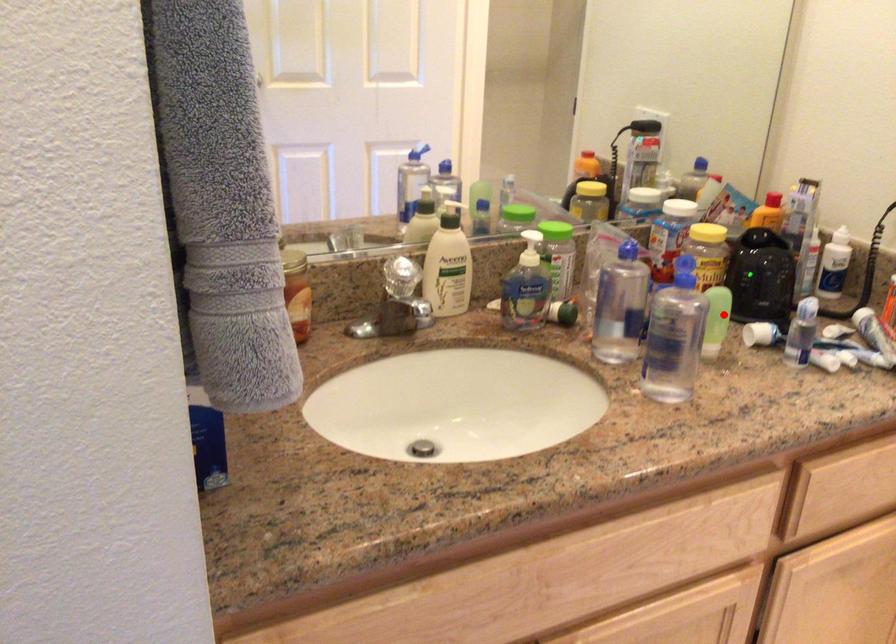
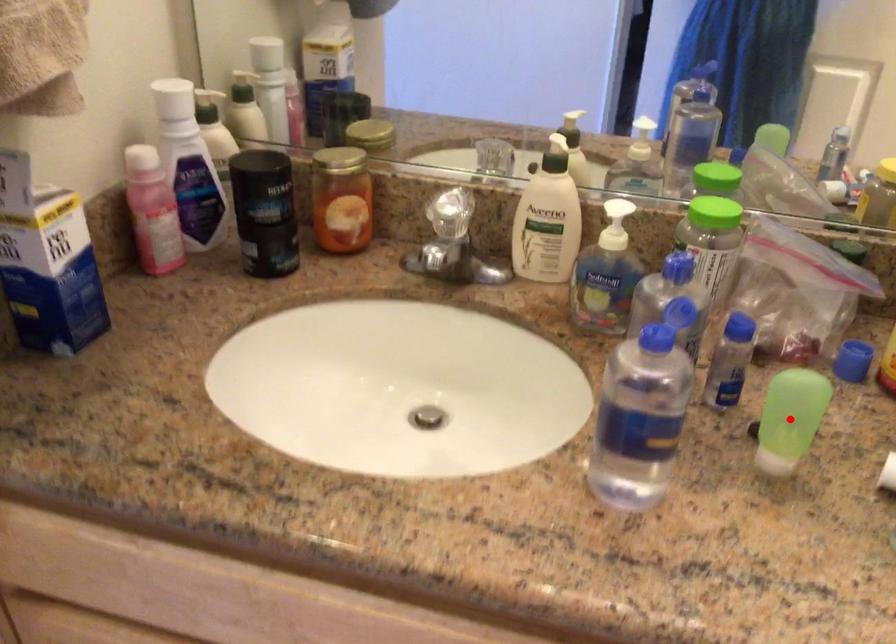
I am providing you with two images of the same scene from different viewpoints. A red point is marked on the first image and another point is marked on the second image. Are the points marked in image1 and image2 representing the same 3D position?

Yes